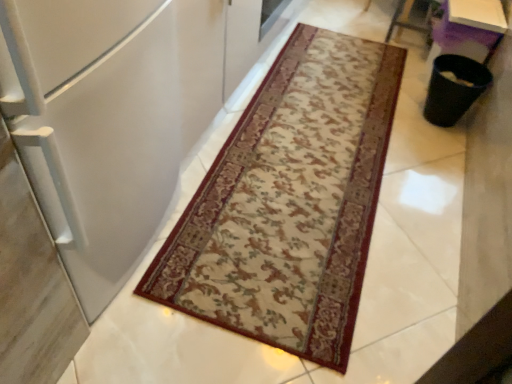
This screenshot has width=512, height=384. Find the location of `vacant area on top of beige carpet with floral pattern at center (from a real-world perspective)`. vacant area on top of beige carpet with floral pattern at center (from a real-world perspective) is located at coordinates (276, 233).